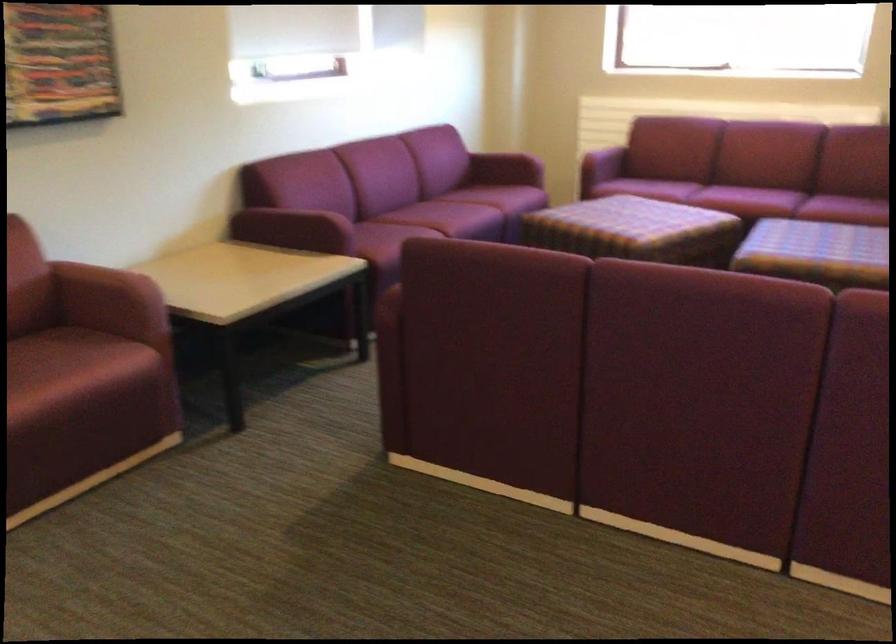
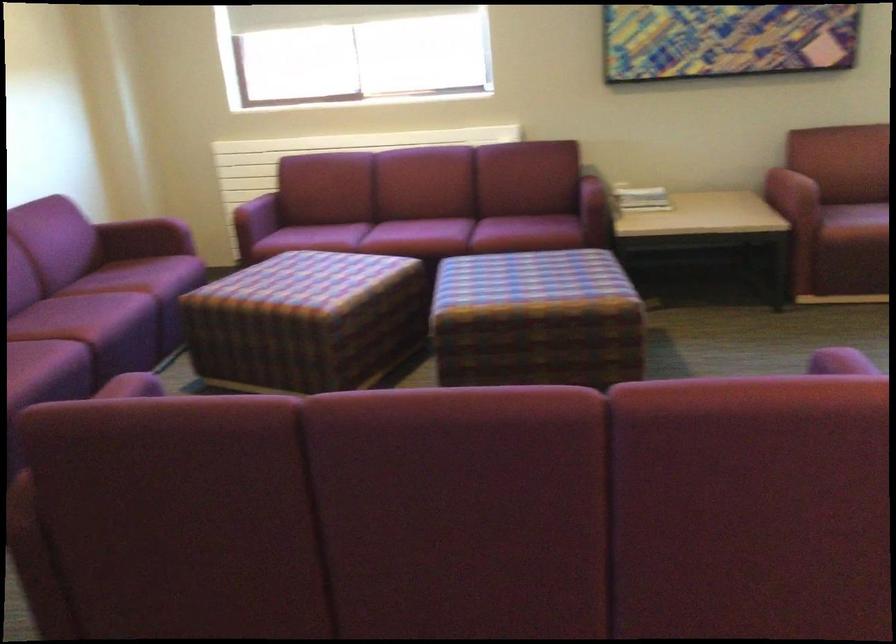
Where in the second image is the point corresponding to (x=622, y=247) from the first image?

(306, 321)